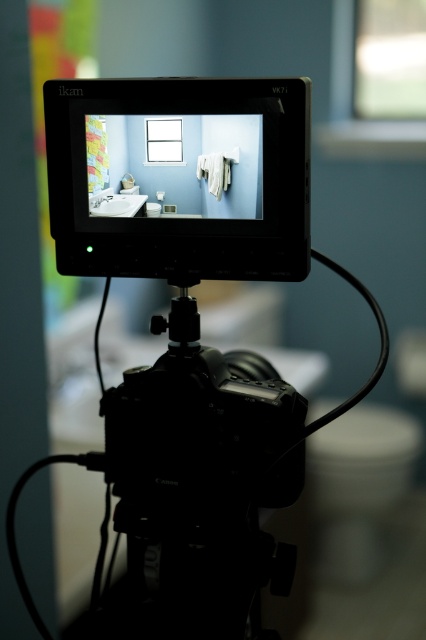
Does black plastic tripod at center have a greater width compared to white glossy toilet bowl at lower right?

In fact, black plastic tripod at center might be narrower than white glossy toilet bowl at lower right.

Is point (213, 460) positioned after point (377, 422)?

That is False.

Which is behind, point (166, 554) or point (322, 502)?

Point (322, 502)

Locate an element on the screen. Image resolution: width=426 pixels, height=640 pixels. black plastic tripod at center is located at coordinates (199, 481).

What do you see at coordinates (181, 177) in the screenshot? I see `black matte monitor at center` at bounding box center [181, 177].

The height and width of the screenshot is (640, 426). What are the coordinates of `black matte monitor at center` in the screenshot? It's located at (181, 177).

Which is in front, point (62, 176) or point (173, 564)?

Positioned in front is point (62, 176).

Locate an element on the screen. Image resolution: width=426 pixels, height=640 pixels. black matte monitor at center is located at coordinates (181, 177).

Can you confirm if black matte monitor at center is positioned to the left of white glossy sink at center?

Incorrect, black matte monitor at center is not on the left side of white glossy sink at center.

Based on the photo, which of these two, black matte monitor at center or white glossy sink at center, stands shorter?

white glossy sink at center

Does point (112, 232) come behind point (131, 204)?

Yes, it is.

Where is `black matte monitor at center`? black matte monitor at center is located at coordinates (181, 177).